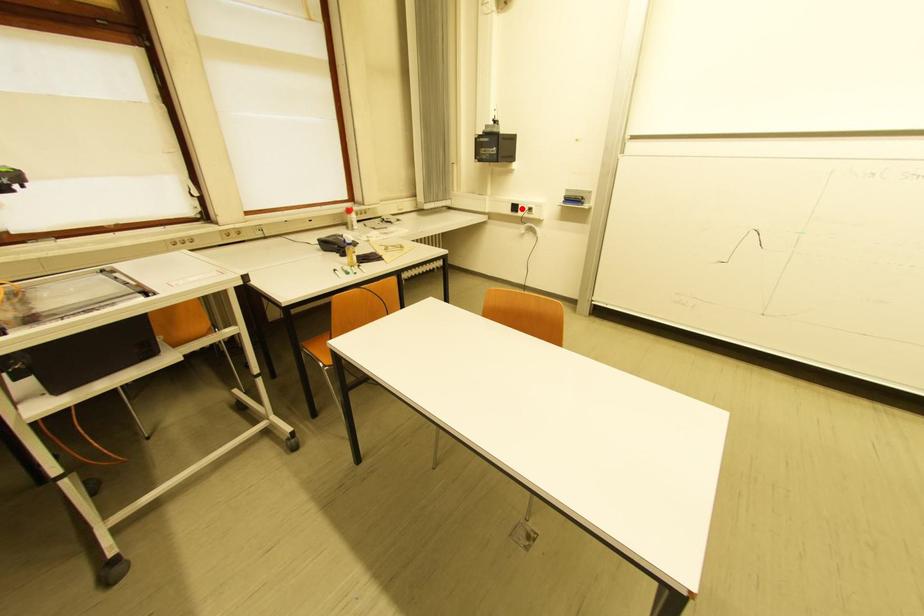
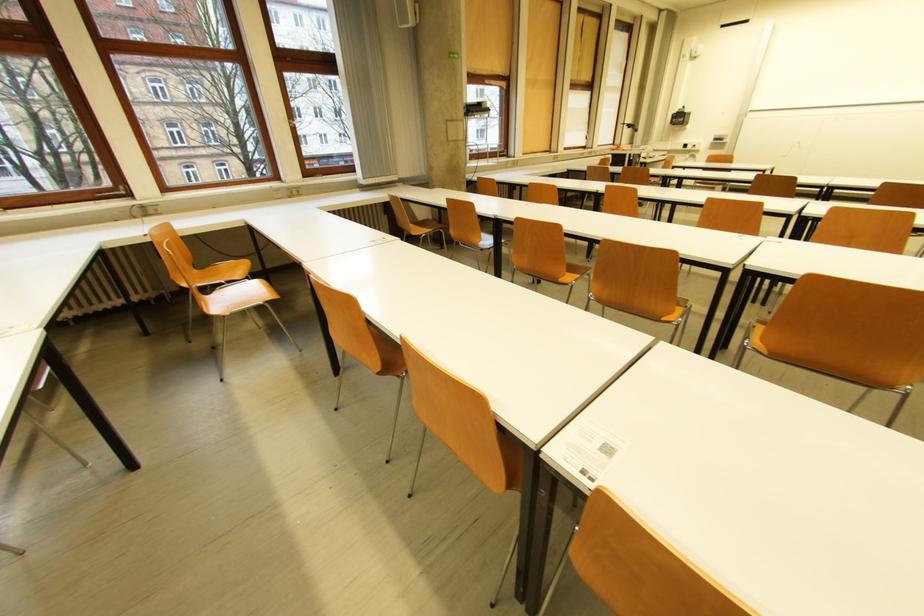
Where in the second image is the point corresponding to the highlighted location from the first image?

(691, 147)